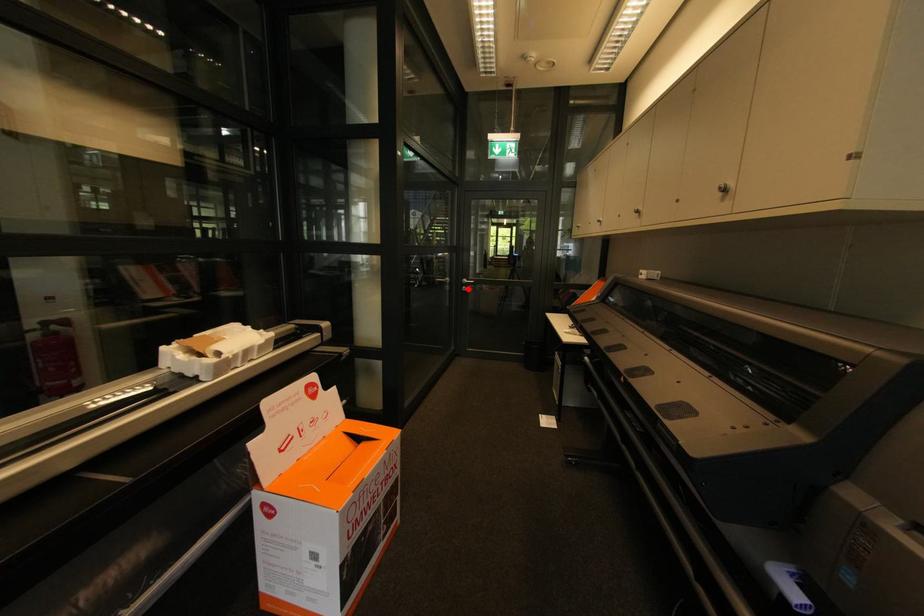
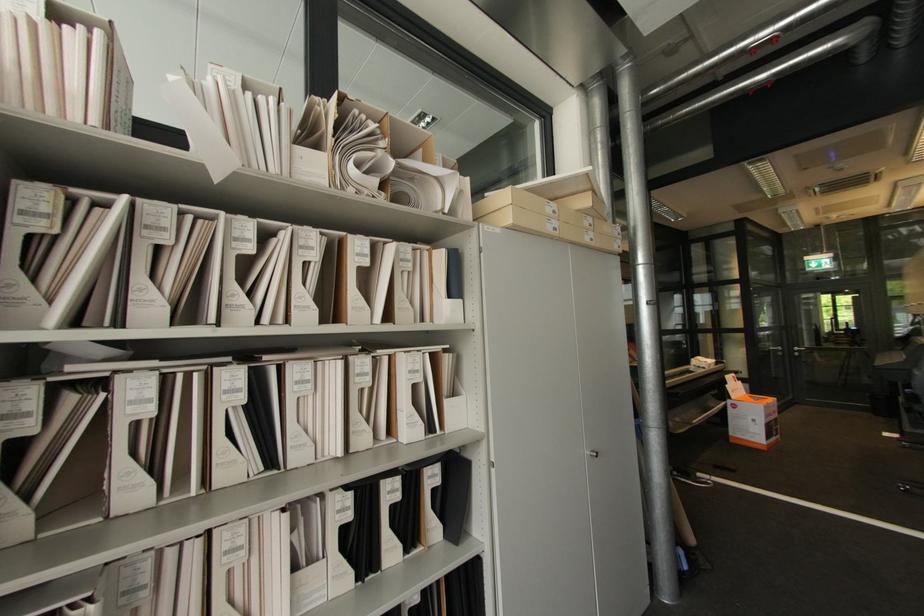
Question: I am providing you with two images of the same scene from different viewpoints. Image1 has a red point marked. In image2, the corresponding 3D location appears at what relative position? Reply with the corresponding letter.

Choices:
 (A) Closer
 (B) Farther

Answer: (A)